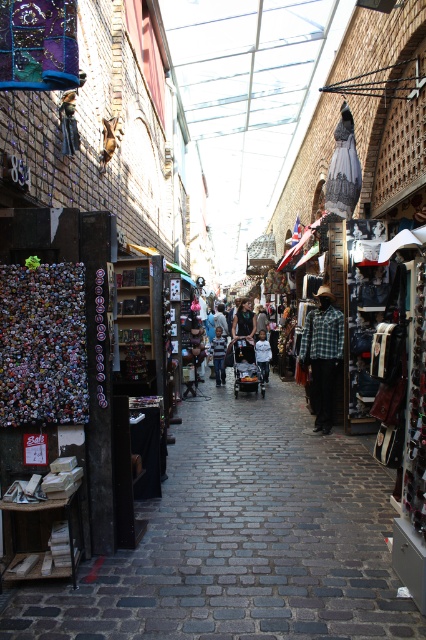
Question: Is smooth wooden shelves at center above striped shirt at center?

Choices:
 (A) yes
 (B) no

Answer: (B)

Question: Can you confirm if smooth wooden shelves at center is wider than flannel shirt at center?

Choices:
 (A) yes
 (B) no

Answer: (A)

Question: Which point appears farthest from the camera in this image?

Choices:
 (A) (224, 378)
 (B) (143, 637)
 (C) (268, 356)

Answer: (A)

Question: Which is farther from the smooth wooden shelves at center?

Choices:
 (A) white cotton shirt at center
 (B) flannel shirt at center
 (C) striped shirt at center

Answer: (C)

Question: Which object is positioned farthest from the striped shirt at center?

Choices:
 (A) white cotton shirt at center
 (B) flannel shirt at center

Answer: (B)

Question: Can you confirm if flannel shirt at center is wider than white cotton shirt at center?

Choices:
 (A) no
 (B) yes

Answer: (B)